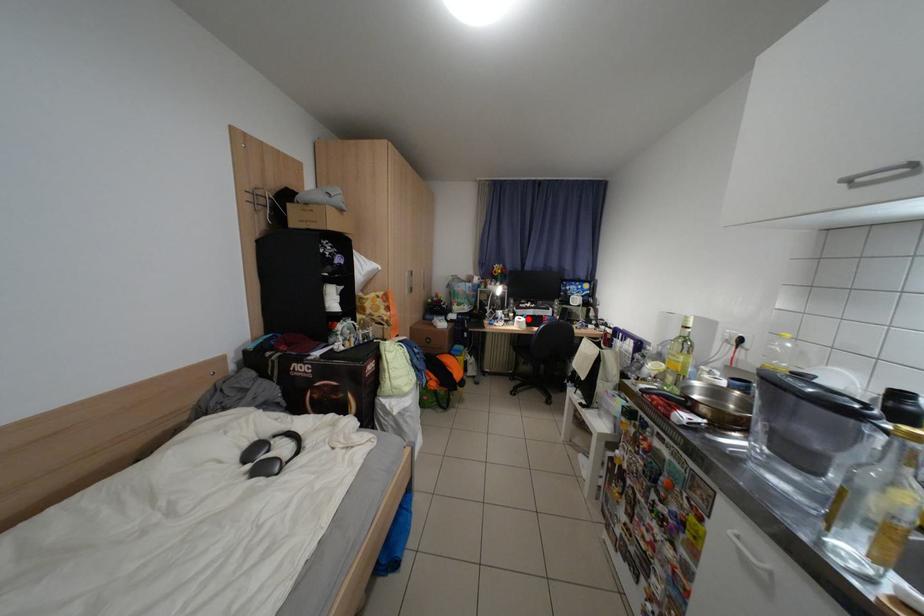
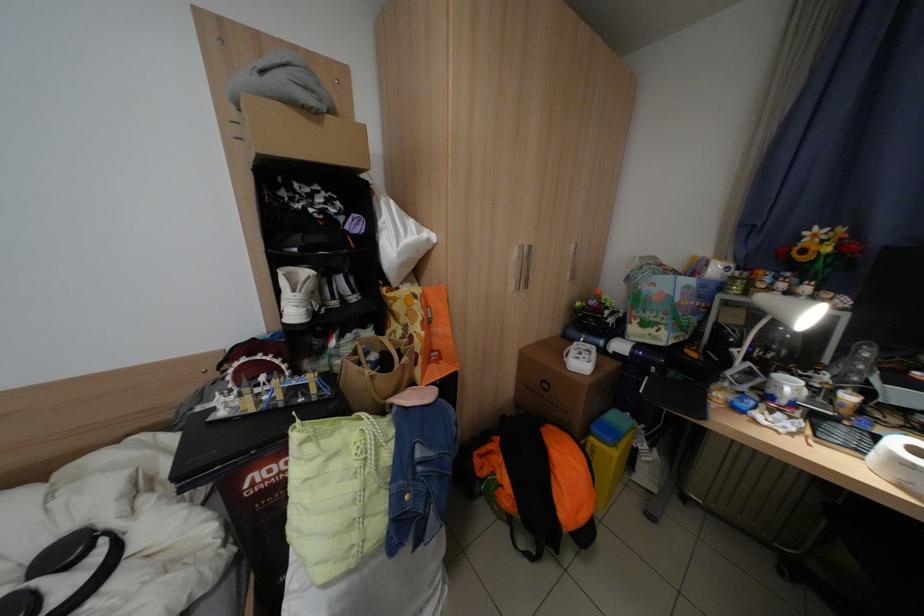
In the second image, find the point that corresponds to the highlighted location in the first image.

(906, 442)